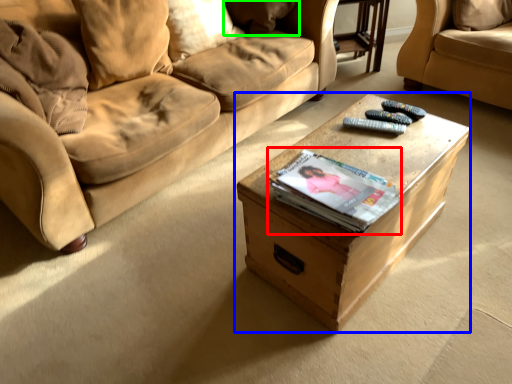
Question: Which object is positioned farthest from paperback book (highlighted by a red box)? Select from table (highlighted by a blue box) and pillow (highlighted by a green box).

Choices:
 (A) table
 (B) pillow

Answer: (B)